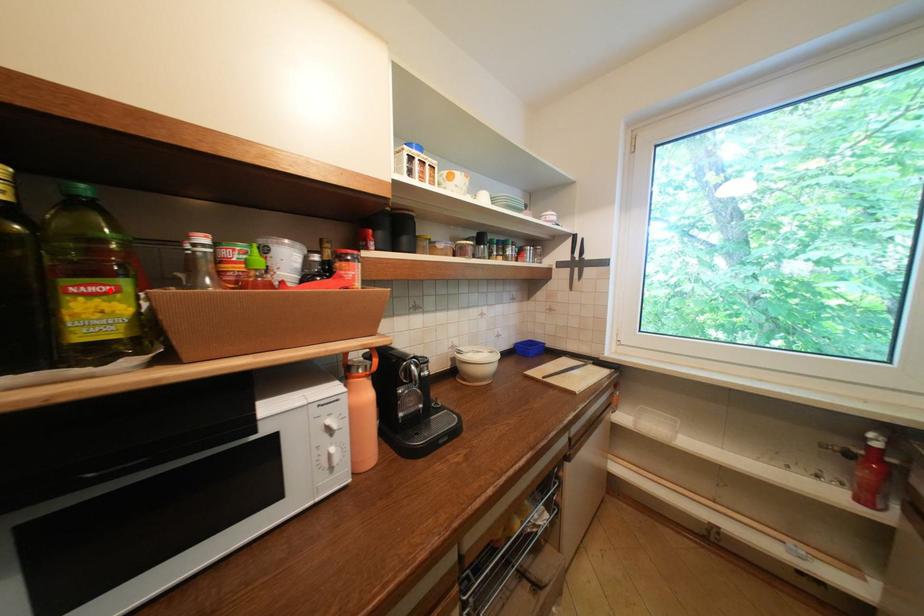
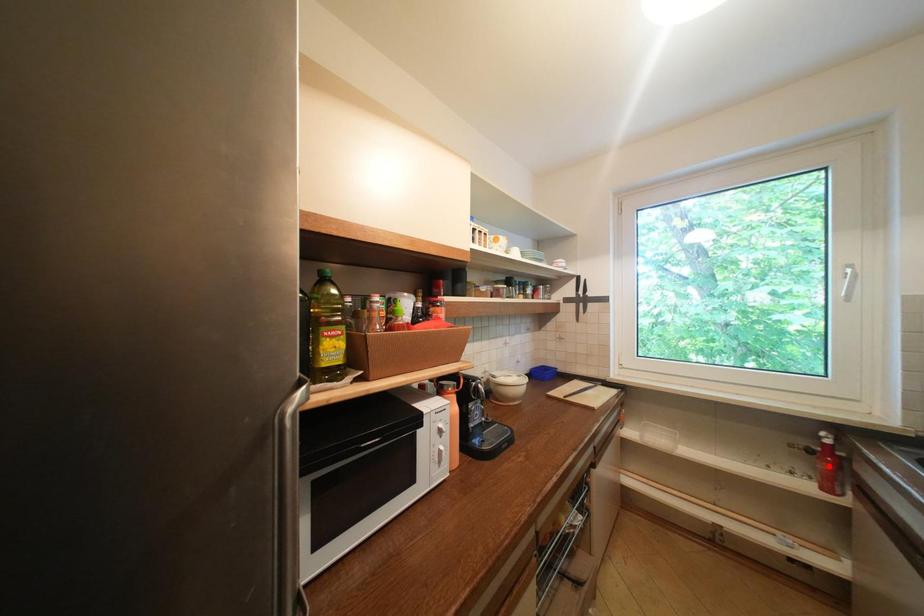
I am providing you with two images of the same scene from different viewpoints. A red point is marked on the first image and another point is marked on the second image. Is the marked point in image1 the same physical position as the marked point in image2?

No